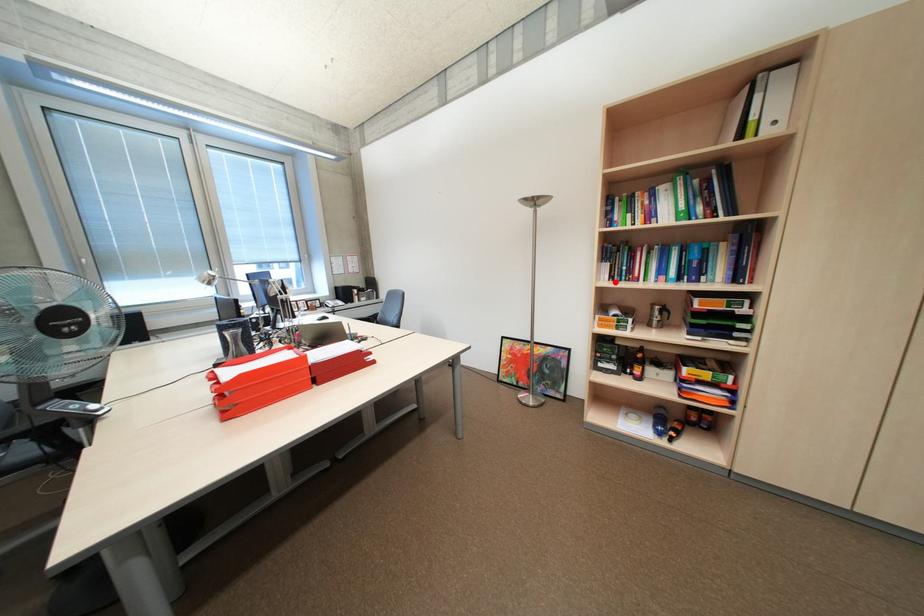
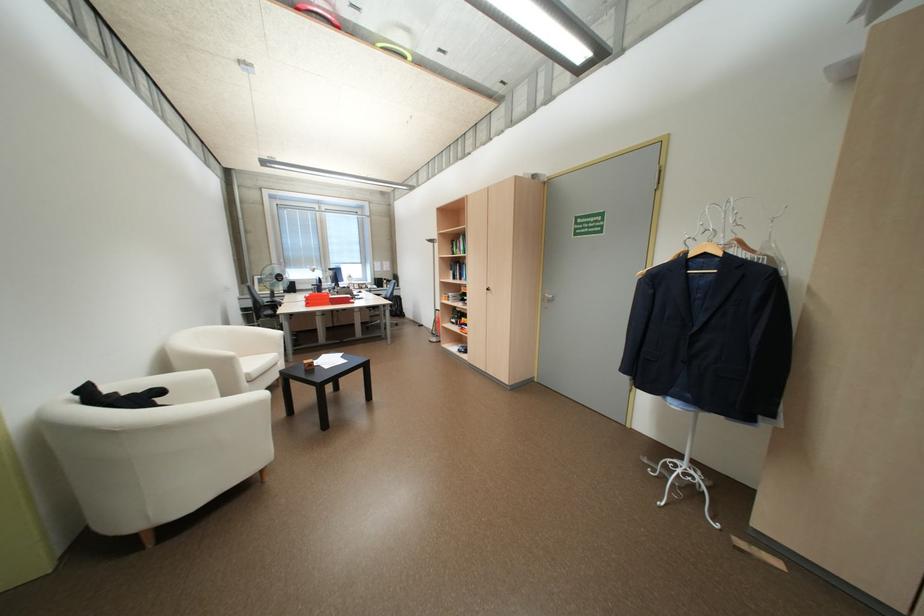
Where in the second image is the point corresponding to the highlighted location from the first image?

(460, 280)